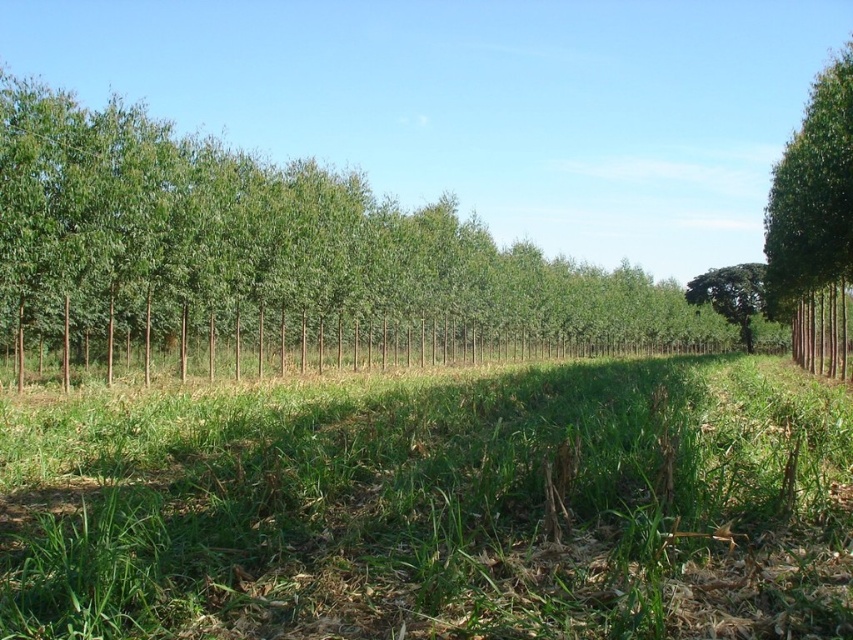
You are a gardener who needs to mow the lawn. You see the green grass at center and the green leafy tree at center. Which one is narrower in width?

The green grass at center has a lesser width compared to the green leafy tree at center.